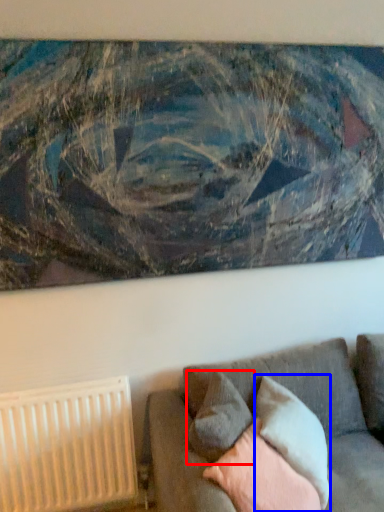
Question: Which of the following is the closest to the observer, pillow (highlighted by a red box) or pillow (highlighted by a blue box)?

Choices:
 (A) pillow
 (B) pillow

Answer: (A)